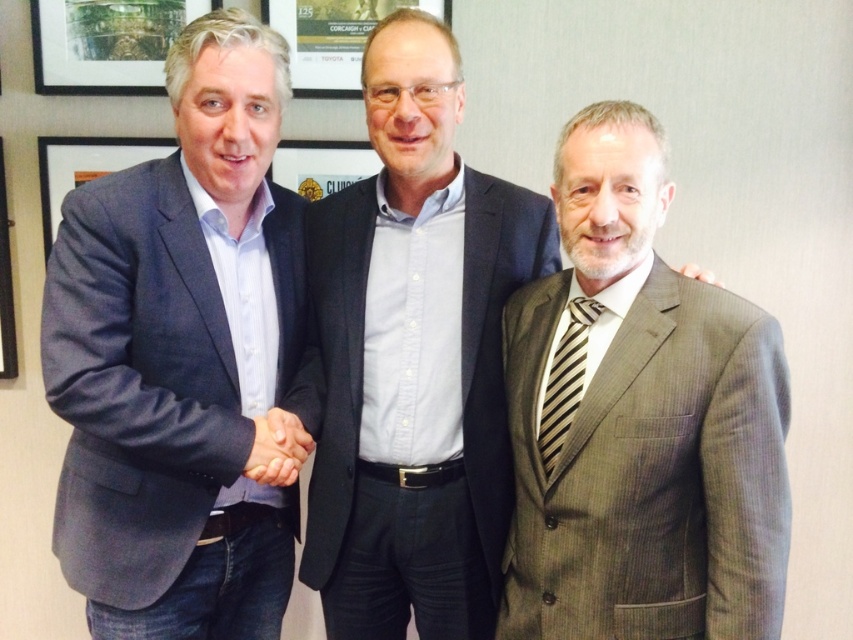
Where is `matte glass picture frame at upper left`? Image resolution: width=853 pixels, height=640 pixels. matte glass picture frame at upper left is located at coordinates point(106,44).

Can you confirm if matte glass picture frame at upper left is positioned to the left of brushed metal picture frame at upper center?

Correct, you'll find matte glass picture frame at upper left to the left of brushed metal picture frame at upper center.

Is point (184, 1) positioned in front of point (352, 65)?

Yes, it is in front of point (352, 65).

What are the coordinates of `matte glass picture frame at upper left` in the screenshot? It's located at (106, 44).

Between point (578, 132) and point (33, 16), which one is positioned behind?

The point (33, 16) is more distant.

Does point (537, 609) lie behind point (128, 36)?

No, it is in front of (128, 36).

What are the coordinates of `gray textured suit at right` in the screenshot? It's located at (639, 420).

What are the coordinates of `gray textured suit at right` in the screenshot? It's located at (639, 420).

Can you confirm if gray textured suit at center is bigger than matte black picture frame at left?

Yes, gray textured suit at center is bigger than matte black picture frame at left.

Can you confirm if gray textured suit at center is shorter than matte black picture frame at left?

In fact, gray textured suit at center may be taller than matte black picture frame at left.

What do you see at coordinates (415, 356) in the screenshot?
I see `gray textured suit at center` at bounding box center [415, 356].

At what (x,y) coordinates should I click in order to perform the action: click on gray textured suit at center. Please return your answer as a coordinate pair (x, y). The width and height of the screenshot is (853, 640). Looking at the image, I should click on (415, 356).